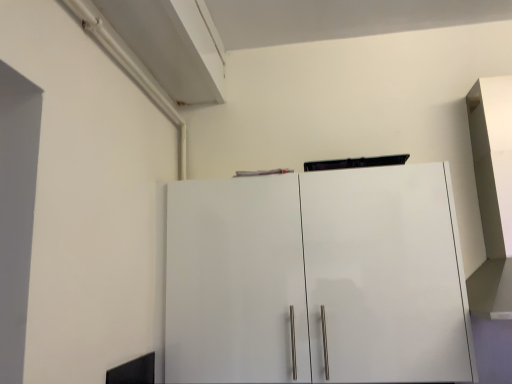
This screenshot has width=512, height=384. What do you see at coordinates (317, 278) in the screenshot?
I see `white glossy cupboard at center` at bounding box center [317, 278].

Find the location of `white glossy cupboard at center`. white glossy cupboard at center is located at coordinates (317, 278).

Where is `white glossy cupboard at center`? The width and height of the screenshot is (512, 384). white glossy cupboard at center is located at coordinates (317, 278).